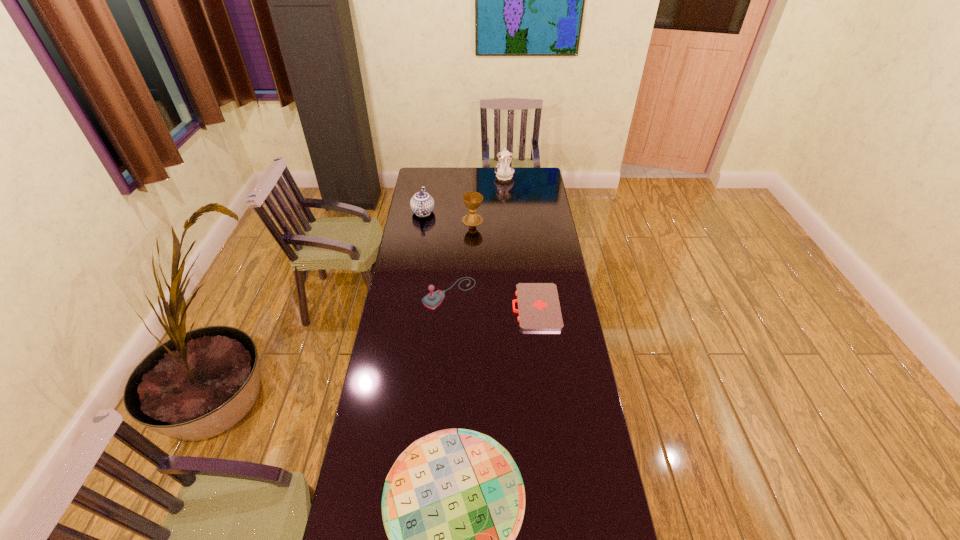
At what (x,y) coordinates should I click in order to perform the action: click on the tallest object. Please return your answer as a coordinate pair (x, y). This screenshot has width=960, height=540. Looking at the image, I should click on (504, 170).

This screenshot has width=960, height=540. I want to click on the farthest object, so click(504, 170).

Locate an element on the screen. The image size is (960, 540). chalice is located at coordinates (472, 200).

Find the location of a particular element. The width and height of the screenshot is (960, 540). the shorter chinaware is located at coordinates (422, 204).

At what (x,y) coordinates should I click in order to perform the action: click on the left chinaware. Please return your answer as a coordinate pair (x, y). Looking at the image, I should click on (422, 204).

Find the location of a particular element. This screenshot has width=960, height=540. joystick is located at coordinates (433, 299).

Identify the location of the first-aid kit. (539, 309).

At what (x,y) coordinates should I click in order to perform the action: click on blank space located 0.180m on the right of the farther chinaware. Please return your answer as a coordinate pair (x, y). The image size is (960, 540). Looking at the image, I should click on (543, 177).

Find the location of a particular element. blank area located 0.390m on the back of the chalice is located at coordinates (473, 177).

Locate an element on the screen. free spot located 0.100m at the spout of the nearer chinaware is located at coordinates (426, 192).